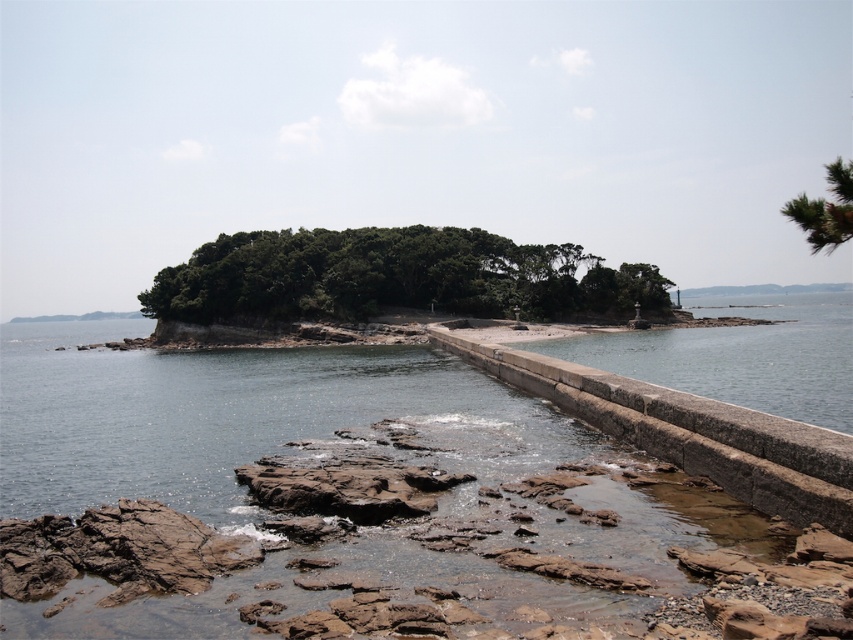
Question: Is clear water at center below green textured pine tree at upper right?

Choices:
 (A) yes
 (B) no

Answer: (A)

Question: Based on their relative distances, which object is nearer to the granite ledge at center?

Choices:
 (A) green textured pine tree at upper right
 (B) green leafy island at center
 (C) clear water at center

Answer: (C)

Question: Which object is positioned closest to the clear water at center?

Choices:
 (A) green textured pine tree at upper right
 (B) green leafy island at center

Answer: (B)

Question: Where is clear water at center located in relation to green textured pine tree at upper right in the image?

Choices:
 (A) below
 (B) above

Answer: (A)

Question: Which point is farther from the camera taking this photo?

Choices:
 (A) (827, 176)
 (B) (254, 296)

Answer: (A)

Question: From the image, what is the correct spatial relationship of clear water at center in relation to green leafy island at center?

Choices:
 (A) above
 (B) below

Answer: (B)